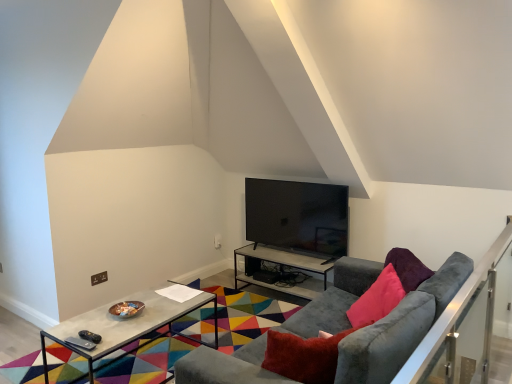
Locate an element on the screen. This screenshot has width=512, height=384. concrete table at center, the first table positioned from the left is located at coordinates (127, 327).

Find the location of a particular element. satin silver balustrade at right is located at coordinates (452, 312).

What do you see at coordinates (400, 327) in the screenshot? The height and width of the screenshot is (384, 512). I see `velvet grey couch at center` at bounding box center [400, 327].

Where is `concrete table at center, the first table positioned from the left`? concrete table at center, the first table positioned from the left is located at coordinates (127, 327).

What's the angular difference between black glossy tv at center and concrete table at center, the first table positioned from the left,'s facing directions?

The angular difference between black glossy tv at center and concrete table at center, the first table positioned from the left, is 2.39 degrees.

Is black glossy tv at center further to the viewer compared to concrete table at center, the first table positioned from the left?

Yes.

How much distance is there between black glossy tv at center and concrete table at center, the first table positioned from the left?

black glossy tv at center and concrete table at center, the first table positioned from the left, are 1.23 meters apart.

Is black glossy tv at center shorter than concrete table at center, acting as the first table starting from the front?

In fact, black glossy tv at center may be taller than concrete table at center, acting as the first table starting from the front.

What's the angular difference between velvet grey couch at center and black glossy tv at center's facing directions?

They differ by 87.1 degrees in their facing directions.

Considering the relative positions of velvet grey couch at center and black glossy tv at center in the image provided, is velvet grey couch at center in front of black glossy tv at center?

Yes, velvet grey couch at center is closer to the viewer.

Looking at this image, from the image's perspective, is velvet grey couch at center located above black glossy tv at center?

No.

Who is bigger, velvet grey couch at center or black glossy tv at center?

Bigger between the two is velvet grey couch at center.

Are black glossy tv at center and satin silver balustrade at right beside each other?

black glossy tv at center is not next to satin silver balustrade at right, and they're not touching.

Who is smaller, black glossy tv at center or satin silver balustrade at right?

With smaller size is black glossy tv at center.

Which is in front, black glossy tv at center or satin silver balustrade at right?

satin silver balustrade at right is more forward.

Would you say velvet grey couch at center is a long distance from metallic gray table at center, placed as the 2th table when sorted from left to right?

Absolutely, velvet grey couch at center is distant from metallic gray table at center, placed as the 2th table when sorted from left to right.

Is velvet grey couch at center not inside metallic gray table at center, the 1th table positioned from the right?

Absolutely, velvet grey couch at center is external to metallic gray table at center, the 1th table positioned from the right.

At what (x,y) coordinates should I click in order to perform the action: click on the 1st table to the left of the velvet grey couch at center, counting from the anchor's position. Please return your answer as a coordinate pair (x, y). Looking at the image, I should click on (283, 265).

Which object is closer to the camera taking this photo, velvet grey couch at center or metallic gray table at center, placed as the 2th table when sorted from left to right?

Positioned in front is velvet grey couch at center.

Is metallic gray table at center, the 1th table viewed from the back, to the left or to the right of black glossy tv at center in the image?

Result: metallic gray table at center, the 1th table viewed from the back, is to the left of black glossy tv at center.

Which is correct: metallic gray table at center, placed as the 2th table when sorted from left to right, is inside black glossy tv at center, or outside of it?

metallic gray table at center, placed as the 2th table when sorted from left to right, is not inside black glossy tv at center, it's outside.

In the scene shown: From the image's perspective, which object appears higher, metallic gray table at center, the 1th table viewed from the back, or black glossy tv at center?

black glossy tv at center, from the image's perspective.

From a real-world perspective, which is physically below, metallic gray table at center, the 1th table positioned from the right, or black glossy tv at center?

metallic gray table at center, the 1th table positioned from the right, from a real-world perspective.

Is velvet grey couch at center next to concrete table at center, the second table viewed from the right?

There is a gap between velvet grey couch at center and concrete table at center, the second table viewed from the right.

Considering the sizes of objects velvet grey couch at center and concrete table at center, arranged as the 2th table when viewed from the back, in the image provided, who is bigger, velvet grey couch at center or concrete table at center, arranged as the 2th table when viewed from the back,?

With larger size is velvet grey couch at center.

Do you think velvet grey couch at center is within concrete table at center, the second table viewed from the right, or outside of it?

velvet grey couch at center is not enclosed by concrete table at center, the second table viewed from the right.

In terms of width, does velvet grey couch at center look wider or thinner when compared to concrete table at center, arranged as the 2th table when viewed from the back?

Clearly, velvet grey couch at center has more width compared to concrete table at center, arranged as the 2th table when viewed from the back.

Which table is the 1st one when counting from the back of the velvet grey couch at center? Please provide its 2D coordinates.

[(127, 327)]

Is concrete table at center, the first table positioned from the left, shorter than velvet grey couch at center?

Indeed, concrete table at center, the first table positioned from the left, has a lesser height compared to velvet grey couch at center.

Consider the image. Can we say concrete table at center, the second table viewed from the right, lies outside velvet grey couch at center?

Yes.

Identify the location of table located in front of the black glossy tv at center. The height and width of the screenshot is (384, 512). (127, 327).

Find the location of a particular element. television above the velvet grey couch at center (from the image's perspective) is located at coordinates (298, 216).

Considering their positions, is satin silver balustrade at right positioned further to concrete table at center, the first table positioned from the left, than velvet grey couch at center?

satin silver balustrade at right is further to concrete table at center, the first table positioned from the left.

When comparing their distances from satin silver balustrade at right, does metallic gray table at center, arranged as the second table when viewed from the front, or concrete table at center, the second table viewed from the right, seem closer?

The object closer to satin silver balustrade at right is concrete table at center, the second table viewed from the right.

In the scene shown: Which object lies nearer to the anchor point metallic gray table at center, arranged as the second table when viewed from the front, black glossy tv at center or velvet grey couch at center?

black glossy tv at center is closer to metallic gray table at center, arranged as the second table when viewed from the front.

Estimate the real-world distances between objects in this image. Which object is further from satin silver balustrade at right, metallic gray table at center, arranged as the second table when viewed from the front, or velvet grey couch at center?

The object further to satin silver balustrade at right is metallic gray table at center, arranged as the second table when viewed from the front.

Estimate the real-world distances between objects in this image. Which object is further from black glossy tv at center, satin silver balustrade at right or velvet grey couch at center?

satin silver balustrade at right lies further to black glossy tv at center than the other object.

Which object lies further to the anchor point concrete table at center, arranged as the 2th table when viewed from the back, satin silver balustrade at right or black glossy tv at center?

satin silver balustrade at right lies further to concrete table at center, arranged as the 2th table when viewed from the back, than the other object.

Which object lies nearer to the anchor point metallic gray table at center, the 1th table viewed from the back, satin silver balustrade at right or velvet grey couch at center?

velvet grey couch at center.

From the picture: Looking at the image, which one is located further to concrete table at center, the second table viewed from the right, velvet grey couch at center or black glossy tv at center?

velvet grey couch at center is further to concrete table at center, the second table viewed from the right.

Locate an element on the screen. table located between satin silver balustrade at right and metallic gray table at center, the 1th table viewed from the back, in the depth direction is located at coordinates (127, 327).

Image resolution: width=512 pixels, height=384 pixels. I want to click on television between velvet grey couch at center and metallic gray table at center, the 1th table viewed from the back, along the z-axis, so click(298, 216).

You are a GUI agent. You are given a task and a screenshot of the screen. Output one action in this format:
    pyautogui.click(x=<x>, y=<y>)
    Task: Click on the studio couch situated between concrete table at center, the second table viewed from the right, and satin silver balustrade at right from left to right
    
    Given the screenshot: What is the action you would take?
    pyautogui.click(x=400, y=327)

Find the location of a particular element. This screenshot has height=384, width=512. table positioned between satin silver balustrade at right and black glossy tv at center from near to far is located at coordinates (127, 327).